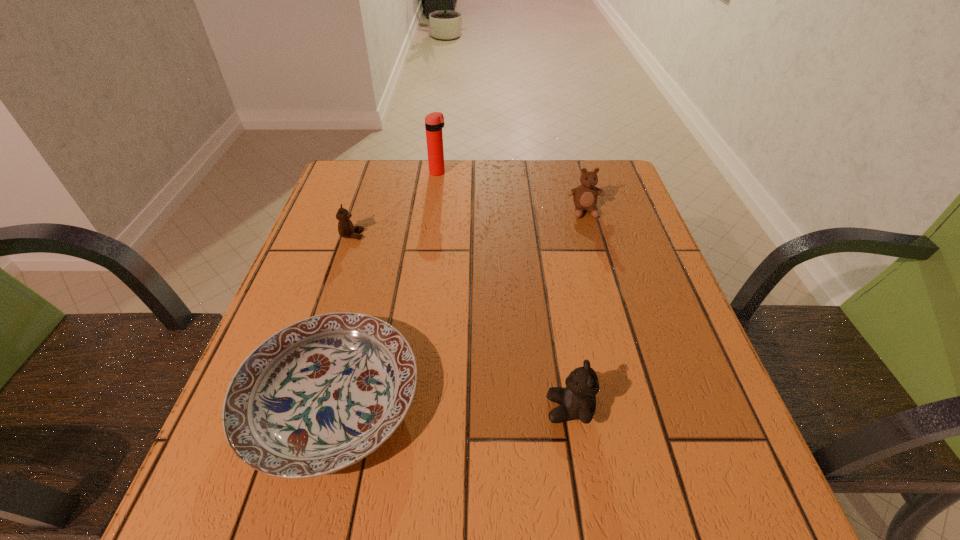
At what (x,y) coordinates should I click in order to perform the action: click on free area in between the nearest teddy bear and the thermos bottle. Please return your answer as a coordinate pair (x, y). Looking at the image, I should click on (504, 291).

Find the location of `object that is the fourth closest to the nearest teddy bear`. object that is the fourth closest to the nearest teddy bear is located at coordinates (434, 122).

Choose which object is the third nearest neighbor to the farthest object. Please provide its 2D coordinates. Your answer should be formatted as a tuple, i.e. [(x, y)], where the tuple contains the x and y coordinates of a point satisfying the conditions above.

[(319, 395)]

Where is `teddy bear that is the second nearest to the rightmost teddy bear`? The image size is (960, 540). teddy bear that is the second nearest to the rightmost teddy bear is located at coordinates [x=346, y=229].

Identify which teddy bear is the second closest to the fourth tallest object. Please provide its 2D coordinates. Your answer should be formatted as a tuple, i.e. [(x, y)], where the tuple contains the x and y coordinates of a point satisfying the conditions above.

[(577, 401)]